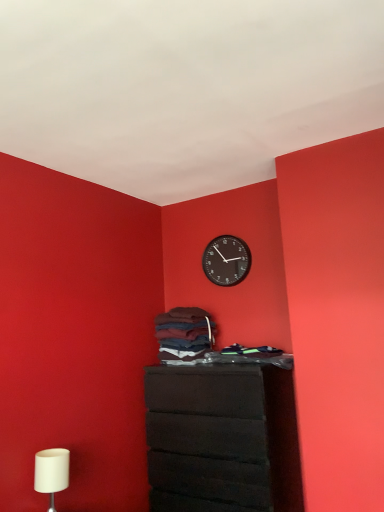
Question: From the image's perspective, is white matte table lamp at lower left located beneath matte black chest of drawers at center?

Choices:
 (A) yes
 (B) no

Answer: (B)

Question: Is white matte table lamp at lower left positioned behind matte black chest of drawers at center?

Choices:
 (A) no
 (B) yes

Answer: (A)

Question: Is white matte table lamp at lower left at the left side of matte black chest of drawers at center?

Choices:
 (A) yes
 (B) no

Answer: (A)

Question: Is white matte table lamp at lower left in front of matte black chest of drawers at center?

Choices:
 (A) yes
 (B) no

Answer: (A)

Question: Is matte black chest of drawers at center at the back of white matte table lamp at lower left?

Choices:
 (A) yes
 (B) no

Answer: (B)

Question: From the image's perspective, would you say white matte table lamp at lower left is positioned over matte black chest of drawers at center?

Choices:
 (A) no
 (B) yes

Answer: (B)

Question: From the image's perspective, is matte black chest of drawers at center located beneath dark blue cotton laundry at center?

Choices:
 (A) yes
 (B) no

Answer: (A)

Question: Considering the relative sizes of matte black chest of drawers at center and dark blue cotton laundry at center in the image provided, is matte black chest of drawers at center bigger than dark blue cotton laundry at center?

Choices:
 (A) no
 (B) yes

Answer: (B)

Question: Are matte black chest of drawers at center and dark blue cotton laundry at center located far from each other?

Choices:
 (A) no
 (B) yes

Answer: (A)

Question: Could you tell me if matte black chest of drawers at center is turned towards dark blue cotton laundry at center?

Choices:
 (A) no
 (B) yes

Answer: (A)

Question: From a real-world perspective, is matte black chest of drawers at center positioned over dark blue cotton laundry at center based on gravity?

Choices:
 (A) yes
 (B) no

Answer: (B)

Question: Does matte black chest of drawers at center lie behind dark blue cotton laundry at center?

Choices:
 (A) yes
 (B) no

Answer: (B)

Question: Is black plastic wall clock at upper center next to white matte table lamp at lower left?

Choices:
 (A) yes
 (B) no

Answer: (B)